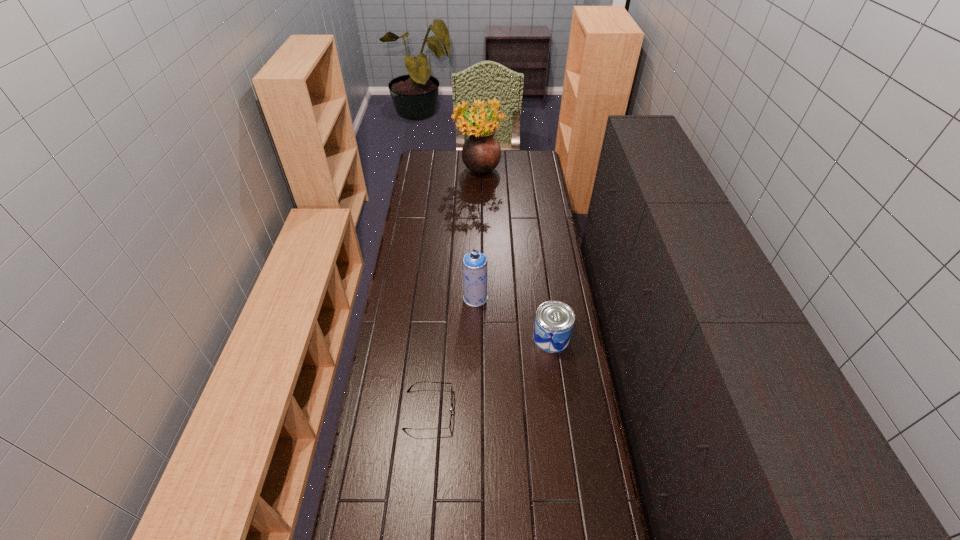
You are a GUI agent. You are given a task and a screenshot of the screen. Output one action in this format:
    pyautogui.click(x=<x>, y=<y>)
    Task: Click on the vacant space located on the front label of the rightmost object
    The height and width of the screenshot is (540, 960).
    Given the screenshot: What is the action you would take?
    pyautogui.click(x=476, y=338)

I want to click on vacant area situated 0.290m on the front label of the rightmost object, so click(459, 338).

This screenshot has height=540, width=960. I want to click on free space located 0.300m on the front label of the rightmost object, so click(x=456, y=338).

You are a GUI agent. You are given a task and a screenshot of the screen. Output one action in this format:
    pyautogui.click(x=<x>, y=<y>)
    Task: Click on the vacant space located on the front-facing side of the shortest object
    Image resolution: width=960 pixels, height=540 pixels.
    Given the screenshot: What is the action you would take?
    pyautogui.click(x=477, y=410)

This screenshot has width=960, height=540. Find the location of `object situated at the far edge`. object situated at the far edge is located at coordinates click(481, 153).

I want to click on object that is at the left edge, so click(x=418, y=382).

This screenshot has height=540, width=960. I want to click on object that is at the right edge, so click(x=554, y=321).

In the image, there is a desktop. Identify the location of blank space at the left edge. The image size is (960, 540). point(384,411).

Image resolution: width=960 pixels, height=540 pixels. Find the location of `vacant space at the right edge of the desktop`. vacant space at the right edge of the desktop is located at coordinates (550, 188).

This screenshot has height=540, width=960. Find the location of `vacant region between the third nearest object and the farthest object`. vacant region between the third nearest object and the farthest object is located at coordinates (477, 235).